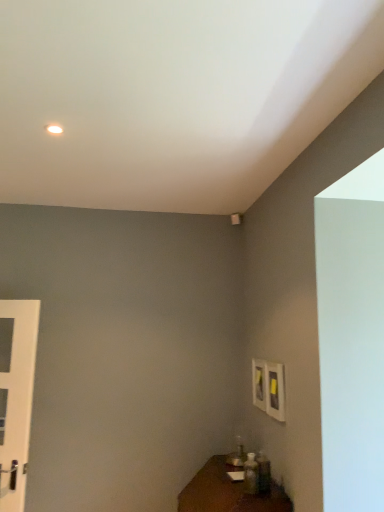
Identify the location of brown wooden table at lower right. coord(228,492).

Describe the element at coordinates (228, 492) in the screenshot. The width and height of the screenshot is (384, 512). I see `brown wooden table at lower right` at that location.

Describe the element at coordinates (16, 396) in the screenshot. This screenshot has height=512, width=384. I see `white glossy door at left` at that location.

Find the location of a particular element. white glossy door at left is located at coordinates (16, 396).

Find the location of a particular element. Image resolution: width=384 pixels, height=512 pixels. brown wooden table at lower right is located at coordinates (228, 492).

Does white glossy door at left appear on the right side of brown wooden table at lower right?

Incorrect, white glossy door at left is not on the right side of brown wooden table at lower right.

Considering their positions, is white glossy door at left located in front of or behind brown wooden table at lower right?

In the image, white glossy door at left appears behind brown wooden table at lower right.

Considering the points (0, 488) and (208, 506), which point is behind, point (0, 488) or point (208, 506)?

The point (0, 488) is farther.

Consider the image. From the image's perspective, is white glossy door at left on brown wooden table at lower right?

Indeed, from the image's perspective, white glossy door at left is shown above brown wooden table at lower right.

From a real-world perspective, is white glossy door at left located beneath brown wooden table at lower right?

Actually, white glossy door at left is physically above brown wooden table at lower right in the real world.

Which object is thinner, white glossy door at left or brown wooden table at lower right?

Thinner between the two is white glossy door at left.

Considering the sizes of objects white glossy door at left and brown wooden table at lower right in the image provided, who is shorter, white glossy door at left or brown wooden table at lower right?

With less height is brown wooden table at lower right.

Can you confirm if white glossy door at left is smaller than brown wooden table at lower right?

Yes.

Is white glossy door at left inside or outside of brown wooden table at lower right?

white glossy door at left is located beyond the bounds of brown wooden table at lower right.

Are white glossy door at left and brown wooden table at lower right located far from each other?

Yes, white glossy door at left is far from brown wooden table at lower right.

Is white glossy door at left facing away from brown wooden table at lower right?

No, white glossy door at left is not facing away from brown wooden table at lower right.

Measure the distance between white glossy door at left and brown wooden table at lower right.

The distance of white glossy door at left from brown wooden table at lower right is 1.23 meters.

The image size is (384, 512). Identify the location of door positioned vertically above the brown wooden table at lower right (from a real-world perspective). (16, 396).

Can you confirm if brown wooden table at lower right is positioned to the left of white glossy door at left?

No.

Between brown wooden table at lower right and white glossy door at left, which one is positioned in front?

brown wooden table at lower right.

Considering the points (187, 487) and (20, 444), which point is behind, point (187, 487) or point (20, 444)?

The point (187, 487) is more distant.

From the image's perspective, which one is positioned higher, brown wooden table at lower right or white glossy door at left?

white glossy door at left is shown above in the image.

From a real-world perspective, is brown wooden table at lower right physically located above or below white glossy door at left?

brown wooden table at lower right is below white glossy door at left.

Which object is thinner, brown wooden table at lower right or white glossy door at left?

With smaller width is white glossy door at left.

From their relative heights in the image, would you say brown wooden table at lower right is taller or shorter than white glossy door at left?

brown wooden table at lower right is shorter than white glossy door at left.

Can you confirm if brown wooden table at lower right is bigger than white glossy door at left?

Correct, brown wooden table at lower right is larger in size than white glossy door at left.

Is brown wooden table at lower right spatially inside white glossy door at left, or outside of it?

brown wooden table at lower right exists outside the volume of white glossy door at left.

Is brown wooden table at lower right far from white glossy door at left?

Absolutely, brown wooden table at lower right is distant from white glossy door at left.

Is brown wooden table at lower right aimed at white glossy door at left?

No, brown wooden table at lower right is not oriented towards white glossy door at left.

What's the angular difference between brown wooden table at lower right and white glossy door at left's facing directions?

The angle between the facing direction of brown wooden table at lower right and the facing direction of white glossy door at left is 67.3 degrees.

Locate an element on the screen. table in front of the white glossy door at left is located at coordinates (228, 492).

Identify the location of table that appears below the white glossy door at left (from a real-world perspective). Image resolution: width=384 pixels, height=512 pixels. (228, 492).

Locate an element on the screen. door located above the brown wooden table at lower right (from the image's perspective) is located at coordinates (16, 396).